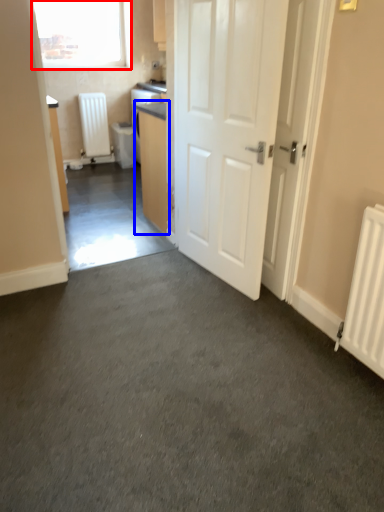
Question: Among these objects, which one is farthest to the camera, window (highlighted by a red box) or cabinetry (highlighted by a blue box)?

Choices:
 (A) window
 (B) cabinetry

Answer: (A)